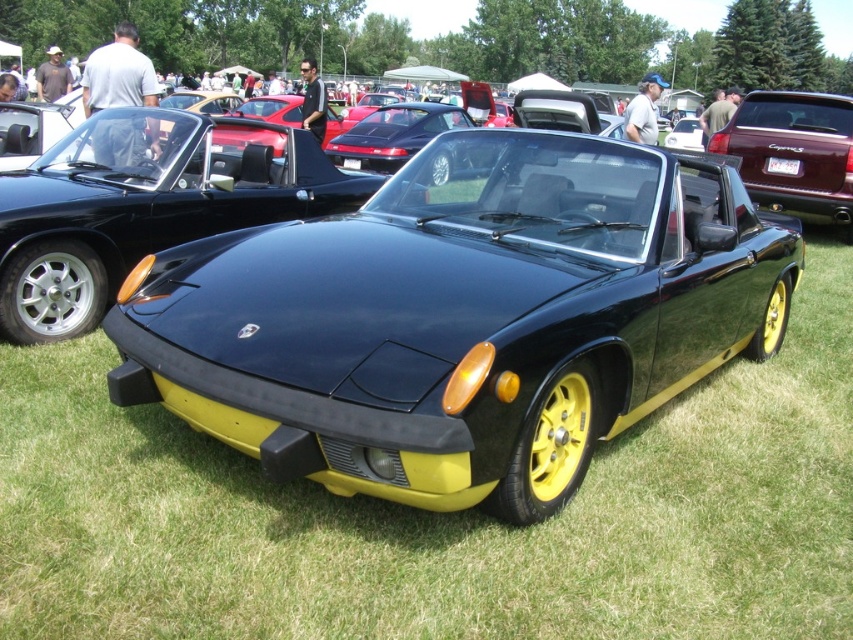
You are at an outdoor car show and want to take a photo of the shiny black convertible at center without any other vehicles blocking the view. Since the matte black convertible at upper right is nearby, will it block your shot? Explain based on their positions.

The shiny black convertible at center is located below the matte black convertible at upper right. Since the matte black convertible is positioned above it, it might block the view unless you adjust your angle or position to capture the lower car without obstruction.

You are a photographer at the car show and want to capture both the shiny black convertible at center and the matte black convertible at upper right in the same frame. Which car should you position closer to the left side of your camera viewfinder to include both?

To include both the shiny black convertible at center and the matte black convertible at upper right in the same frame, you should position the shiny black convertible at center closer to the left side of your camera viewfinder since it is already on the left side of the matte black convertible at upper right.